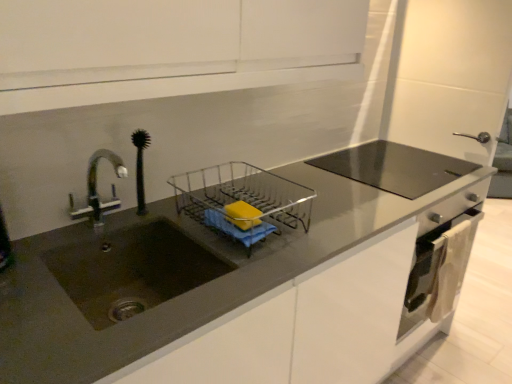
Identify the location of vacant space behind clear plastic dish rack at center. (251, 186).